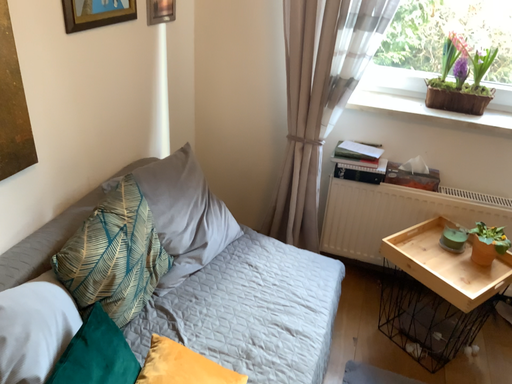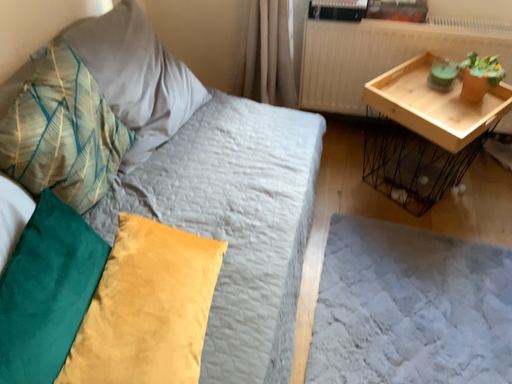
Question: Which way did the camera rotate in the video?

Choices:
 (A) rotated downward
 (B) rotated upward

Answer: (A)